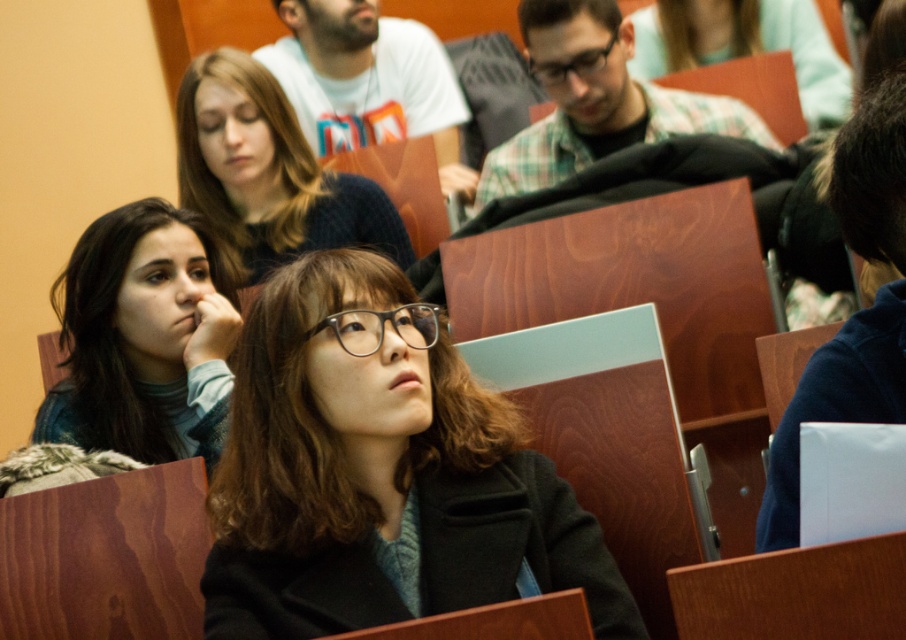
You are sitting at a desk in the lecture hall and notice two items in your view. The light blue sweater at left and the black plastic glasses at center. Which item is closer to you?

The light blue sweater at left is closer to you because it is in front of the black plastic glasses at center.

You are organizing a display and need to know the relative sizes of the dark brown sweater at upper center and the black plastic glasses at center. Which object is wider?

The dark brown sweater at upper center might be wider than black plastic glasses at center according to the description.